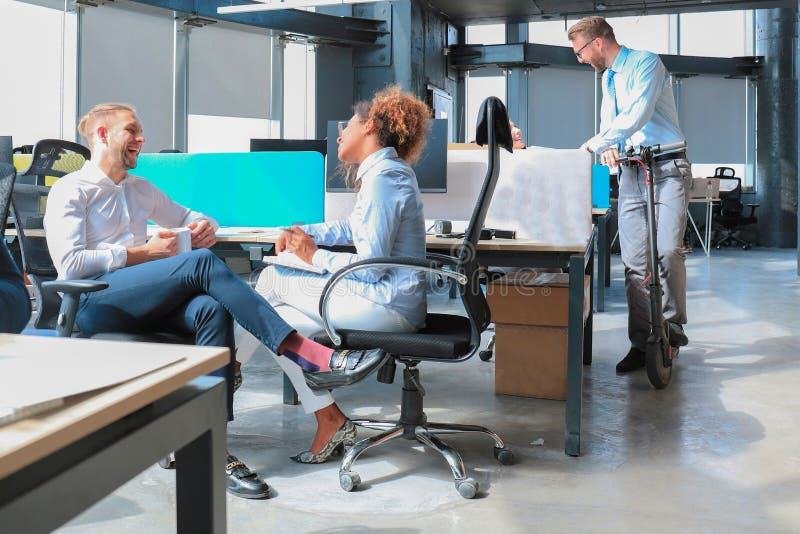
Where is `papers on desktop`? Image resolution: width=800 pixels, height=534 pixels. papers on desktop is located at coordinates (65, 368), (22, 400), (25, 410), (54, 400).